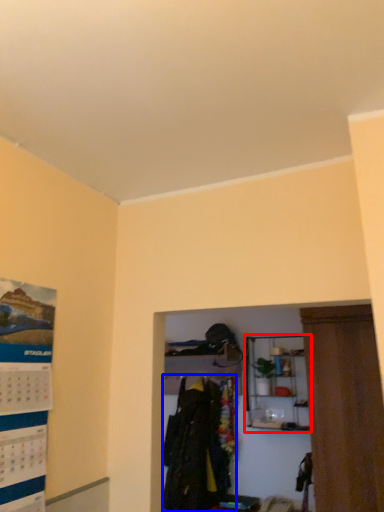
Question: Which of the following is the farthest to the observer, shelf (highlighted by a red box) or clothing (highlighted by a blue box)?

Choices:
 (A) shelf
 (B) clothing

Answer: (B)